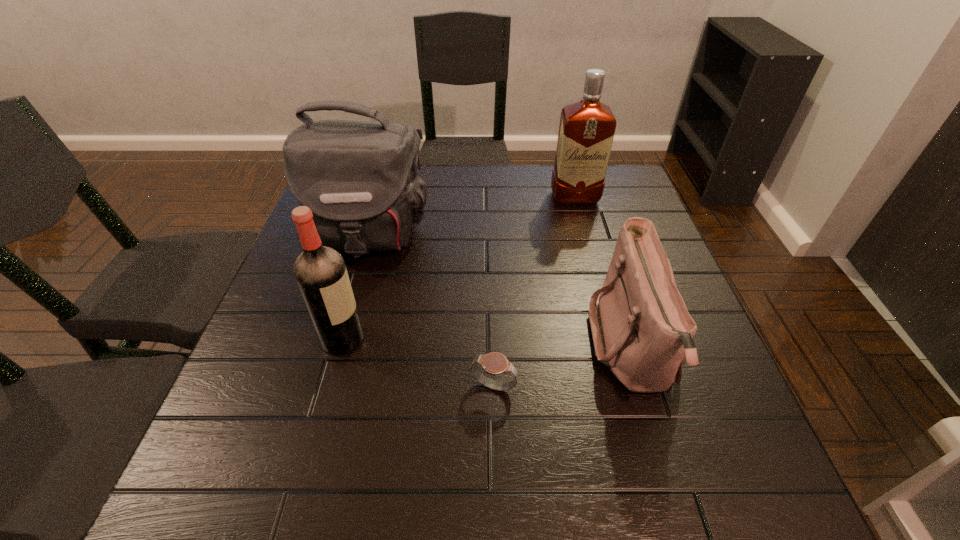
You are a GUI agent. You are given a task and a screenshot of the screen. Output one action in this format:
    pyautogui.click(x=<x>, y=<y>)
    Task: Click on the shoulder bag positioned at the right edge
    
    Given the screenshot: What is the action you would take?
    pyautogui.click(x=641, y=328)

Locate an element on the screen. Image resolution: width=960 pixels, height=540 pixels. object at the far left corner is located at coordinates (360, 179).

Identify the location of object present at the far right corner. Image resolution: width=960 pixels, height=540 pixels. (586, 131).

In the image, there is a desktop. Find the location of `free space at the far edge`. free space at the far edge is located at coordinates (444, 185).

In the image, there is a desktop. In order to click on vacant space at the near edge in this screenshot , I will do `click(530, 507)`.

At what (x,y) coordinates should I click in order to perform the action: click on free space at the left edge of the desktop. Please return your answer as a coordinate pair (x, y). This screenshot has width=960, height=540. Looking at the image, I should click on (299, 419).

Find the location of a particular element. The width and height of the screenshot is (960, 540). blank region between the watch and the left liquor is located at coordinates (419, 363).

I want to click on vacant area between the third object from right to left and the farther shoulder bag, so (431, 312).

You are a GUI agent. You are given a task and a screenshot of the screen. Output one action in this format:
    pyautogui.click(x=<x>, y=<y>)
    Task: Click on the vacant area between the left shoulder bag and the left liquor
    Image resolution: width=960 pixels, height=540 pixels.
    Given the screenshot: What is the action you would take?
    pyautogui.click(x=356, y=287)

Locate an element on the screen. vacant area between the left liquor and the shorter shoulder bag is located at coordinates [x=488, y=343].